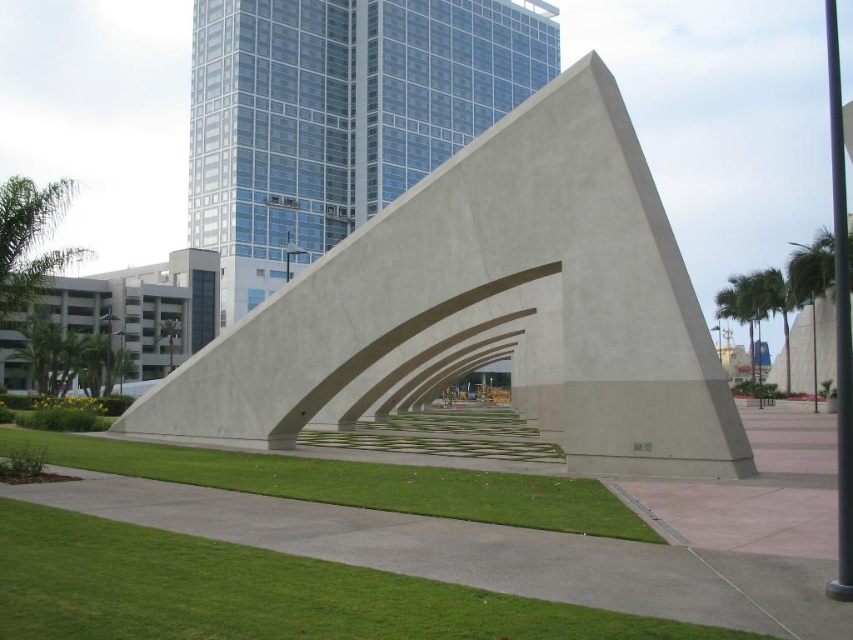
You are a landscape architect evaluating the urban space. You need to determine if the green grass at center can be mowed without damaging the smooth concrete sculpture at center. Can you confirm based on their heights?

The smooth concrete sculpture at center is taller than the green grass at center, so mowing the green grass at center won generated any damage to the sculpture.

You are standing in the urban park and want to take a photo of the smooth concrete sculpture at center. If your camera has a maximum focus range of 15 meters, will you be able to capture a clear image of the sculpture?

The smooth concrete sculpture at center is 14.22 meters away from the viewer. Since the camera can focus up to 15 meters, it is within range, so yes, you can capture a clear image.